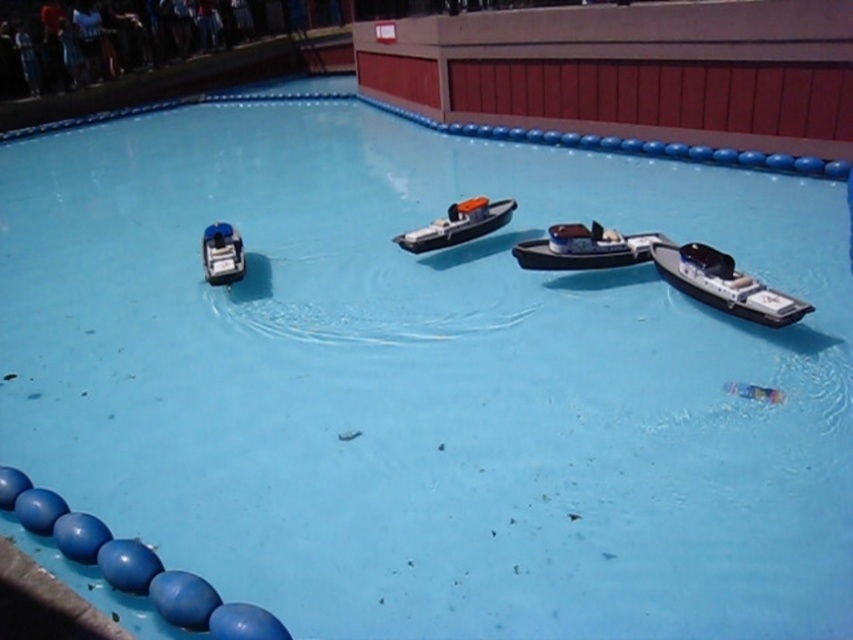
You are a visitor standing at the edge of the circular pool in the miniature waterway scene. You want to locate the orange matte boat at center. Based on its coordinates, where should you look relative to the pool?

The orange matte boat at center is located at coordinates point (457,225), which is slightly to the left and above the center point of the pool.

You are a visitor at the waterway scene and want to know which boat is larger between the orange matte boat at center and the shiny blue toy boat at left. Can you tell me?

The orange matte boat at center is bigger than the shiny blue toy boat at left, so it is larger.

From the picture: You are a visitor at the waterway scene and want to know the relative positions of the shiny silver boat at center and the shiny blue toy boat at left. Which boat is located to the right of the other?

The shiny silver boat at center is positioned on the right side of the shiny blue toy boat at left.